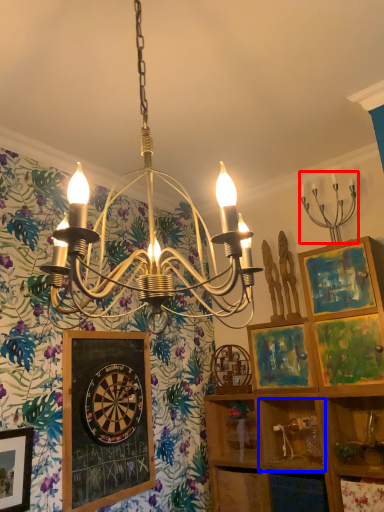
Question: Which of the following is the farthest to the observer, light fixture (highlighted by a red box) or cabinet (highlighted by a blue box)?

Choices:
 (A) light fixture
 (B) cabinet

Answer: (B)